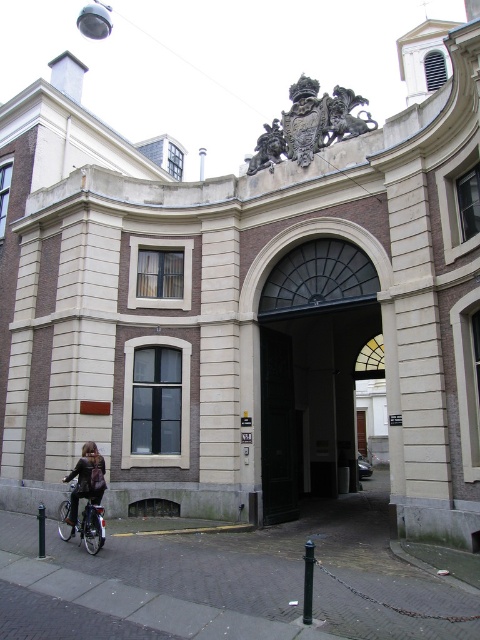
Which is below, bronze/golden statue at upper center or silver metallic bicycle at lower left?

silver metallic bicycle at lower left is below.

Describe the element at coordinates (347, 115) in the screenshot. This screenshot has width=480, height=640. I see `bronze/golden statue at upper center` at that location.

Is point (340, 115) more distant than point (82, 538)?

Yes, it is.

Where is `bronze/golden statue at upper center`? This screenshot has height=640, width=480. bronze/golden statue at upper center is located at coordinates (347, 115).

Does matte black jacket at lower left appear over bronze statue at center?

No, matte black jacket at lower left is not above bronze statue at center.

Which is behind, point (93, 461) or point (276, 129)?

Point (276, 129)

What do you see at coordinates (85, 481) in the screenshot?
I see `matte black jacket at lower left` at bounding box center [85, 481].

I want to click on matte black jacket at lower left, so click(85, 481).

From the picture: Is gold metallic coat of arms at center top shorter than silver metallic bicycle at lower left?

No.

Is point (263, 164) behind point (62, 524)?

That is True.

Does point (266, 138) lie behind point (92, 532)?

Yes, point (266, 138) is farther from viewer.

I want to click on gold metallic coat of arms at center top, so click(x=310, y=124).